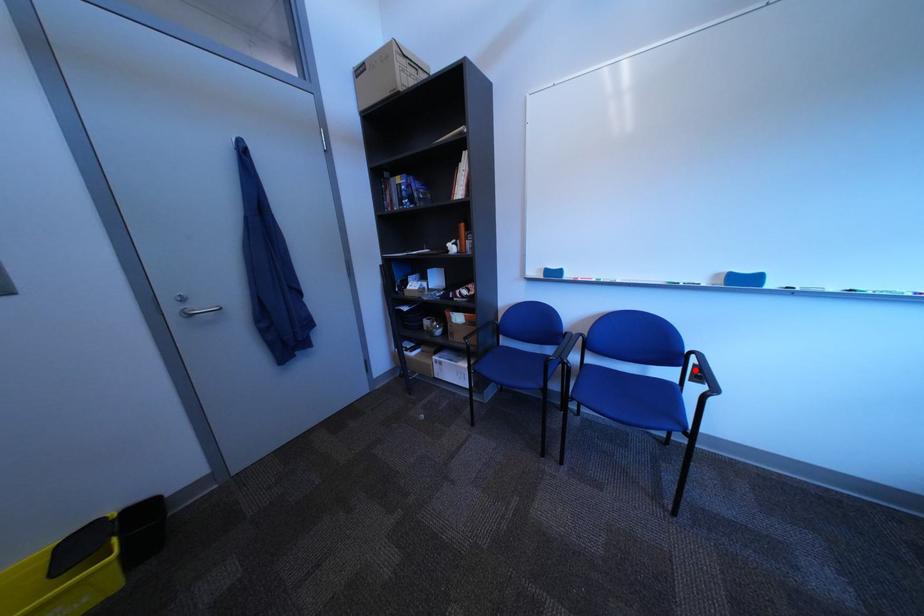
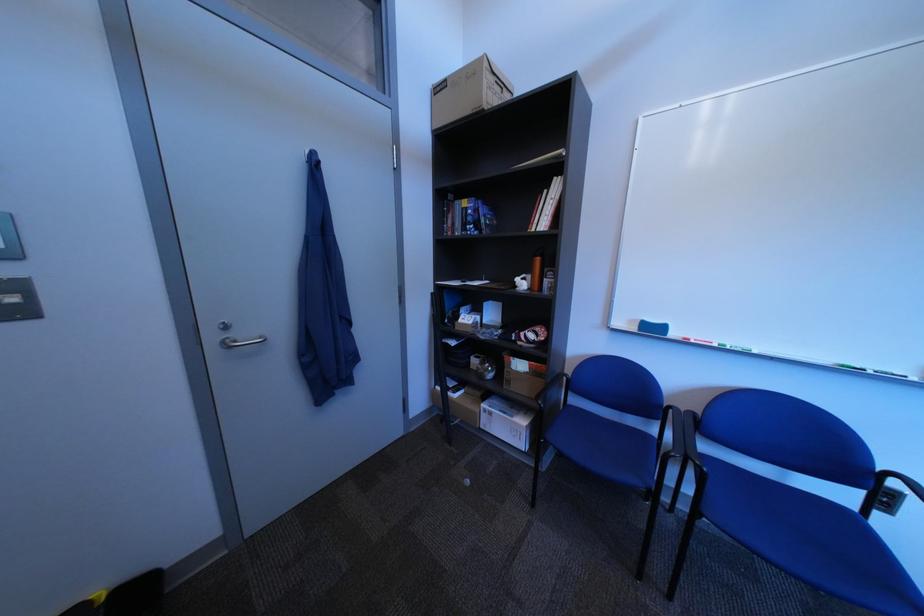
Question: I am providing you with two images of the same scene from different viewpoints. Image1 has a red point marked. In image2, the corresponding 3D location appears at what relative position? Reply with the corresponding letter.

Choices:
 (A) Closer
 (B) Farther

Answer: (B)